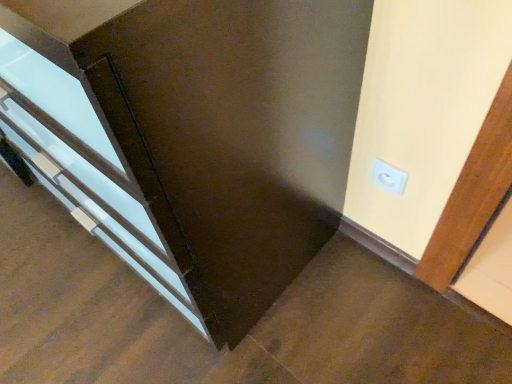
The image size is (512, 384). Find the location of `white plastic outlet at upper right`. white plastic outlet at upper right is located at coordinates 388,177.

Measure the distance between point (x=390, y=188) and camera.

Point (x=390, y=188) is 37.76 inches away from camera.

Consider the image. Measure the distance between white plastic outlet at upper right and camera.

They are 35.55 inches apart.

Image resolution: width=512 pixels, height=384 pixels. What do you see at coordinates (388, 177) in the screenshot?
I see `white plastic outlet at upper right` at bounding box center [388, 177].

What do you see at coordinates (234, 135) in the screenshot? I see `matte white door at center` at bounding box center [234, 135].

Locate an element on the screen. This screenshot has height=384, width=512. matte white door at center is located at coordinates (234, 135).

What is the approximate width of matte white door at center?

The width of matte white door at center is 20.15 inches.

This screenshot has height=384, width=512. I want to click on white plastic outlet at upper right, so click(388, 177).

Is white plastic outlet at upper right to the left of matte white door at center from the viewer's perspective?

In fact, white plastic outlet at upper right is to the right of matte white door at center.

Considering the positions of objects white plastic outlet at upper right and matte white door at center in the image provided, who is in front, white plastic outlet at upper right or matte white door at center?

matte white door at center is closer to the camera.

Considering the points (397, 192) and (187, 214), which point is in front, point (397, 192) or point (187, 214)?

Positioned in front is point (187, 214).

From the image's perspective, is white plastic outlet at upper right located above or below matte white door at center?

white plastic outlet at upper right is situated lower than matte white door at center in the image.

From a real-world perspective, is white plastic outlet at upper right beneath matte white door at center?

Correct, in the physical world, white plastic outlet at upper right is lower than matte white door at center.

Consider the image. Can you confirm if white plastic outlet at upper right is thinner than matte white door at center?

Correct, the width of white plastic outlet at upper right is less than that of matte white door at center.

Does white plastic outlet at upper right have a lesser height compared to matte white door at center?

Yes, white plastic outlet at upper right is shorter than matte white door at center.

Who is bigger, white plastic outlet at upper right or matte white door at center?

Bigger between the two is matte white door at center.

Consider the image. Would you say matte white door at center is part of white plastic outlet at upper right's contents?

No, matte white door at center is not inside white plastic outlet at upper right.

Are white plastic outlet at upper right and matte white door at center located far from each other?

white plastic outlet at upper right is actually quite close to matte white door at center.

Is white plastic outlet at upper right oriented away from matte white door at center?

white plastic outlet at upper right does not have its back to matte white door at center.

This screenshot has height=384, width=512. I want to click on electric outlet beneath the matte white door at center (from a real-world perspective), so click(388, 177).

Which object is positioned more to the right, matte white door at center or white plastic outlet at upper right?

white plastic outlet at upper right.

Which object is further away from the camera taking this photo, matte white door at center or white plastic outlet at upper right?

white plastic outlet at upper right.

Which point is more distant from viewer, (301,229) or (385,187)?

The point (301,229) is farther from the camera.

From the image's perspective, is matte white door at center over white plastic outlet at upper right?

Yes, from the image's perspective, matte white door at center is on top of white plastic outlet at upper right.

From a real-world perspective, between matte white door at center and white plastic outlet at upper right, who is vertically lower?

white plastic outlet at upper right.

Can you confirm if matte white door at center is thinner than white plastic outlet at upper right?

No.

Considering the sizes of matte white door at center and white plastic outlet at upper right in the image, is matte white door at center taller or shorter than white plastic outlet at upper right?

Clearly, matte white door at center is taller compared to white plastic outlet at upper right.

Which of these two, matte white door at center or white plastic outlet at upper right, is smaller?

With smaller size is white plastic outlet at upper right.

Is matte white door at center completely or partially outside of white plastic outlet at upper right?

matte white door at center is positioned outside white plastic outlet at upper right.

Is matte white door at center next to white plastic outlet at upper right and touching it?

matte white door at center and white plastic outlet at upper right are clearly separated.

Is matte white door at center aimed at white plastic outlet at upper right?

No.

In the image, there is a matte white door at center. Identify the location of electric outlet below it (from a real-world perspective). (388, 177).

The image size is (512, 384). In order to click on door that appears on the left of white plastic outlet at upper right in this screenshot , I will do `click(234, 135)`.

In the image, there is a matte white door at center. Where is `electric outlet below it (from a real-world perspective)`? electric outlet below it (from a real-world perspective) is located at coordinates tap(388, 177).